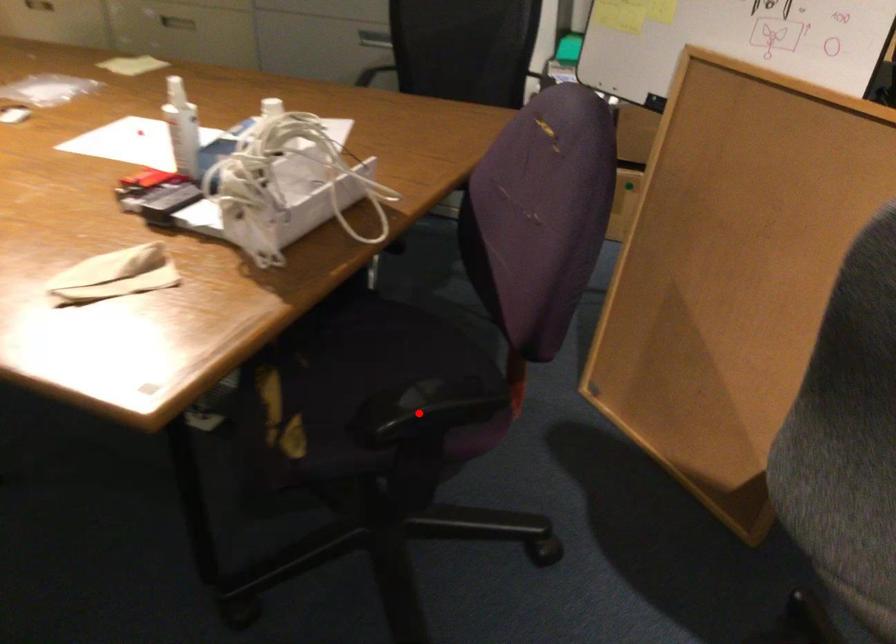
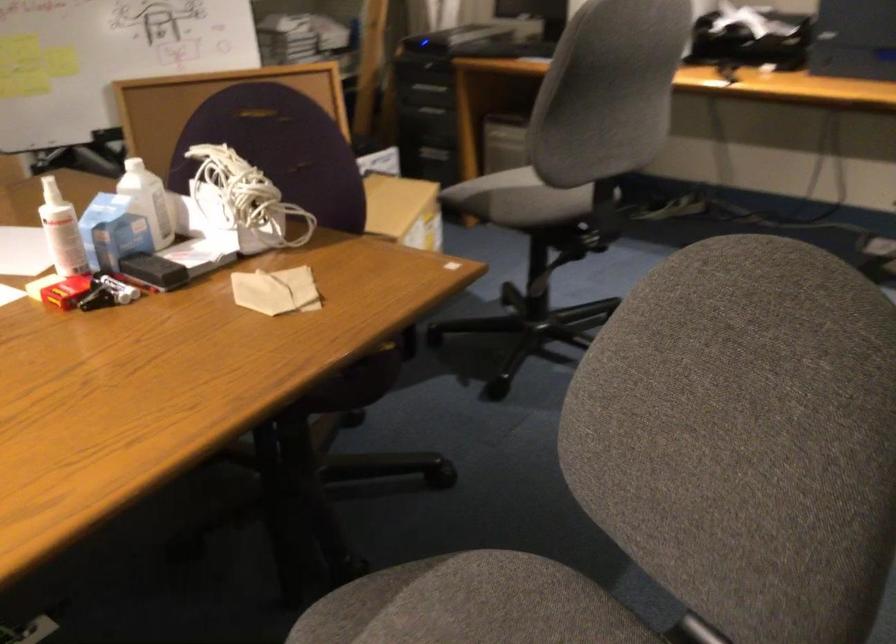
Question: I am providing you with two images of the same scene from different viewpoints. A red point is marked on the first image. Can you still see the location of the red point in image 2?

Choices:
 (A) Yes
 (B) No

Answer: (B)